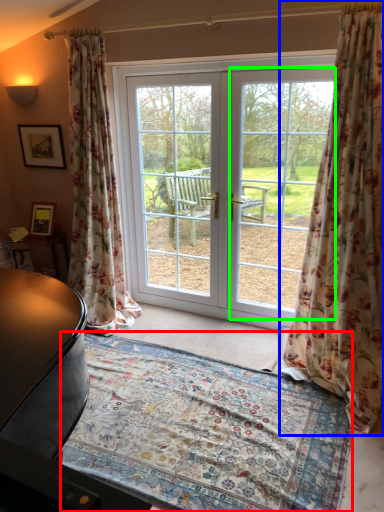
Question: Which object is positioned farthest from mat (highlighted by a red box)? Select from curtain (highlighted by a blue box) and window screen (highlighted by a green box).

Choices:
 (A) curtain
 (B) window screen

Answer: (B)